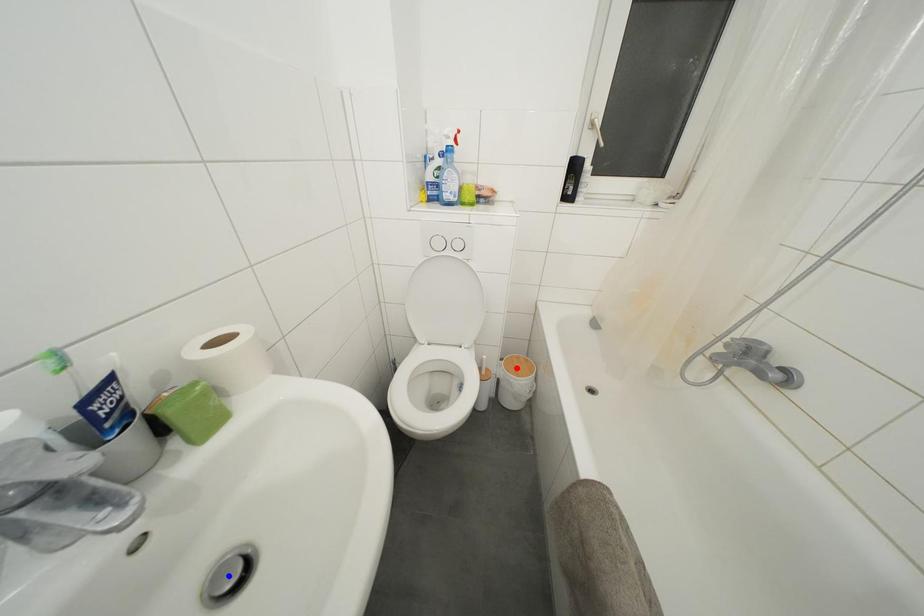
Question: Which of the two points in the image is closer to the camera?

Choices:
 (A) Blue point is closer.
 (B) Red point is closer.

Answer: (A)